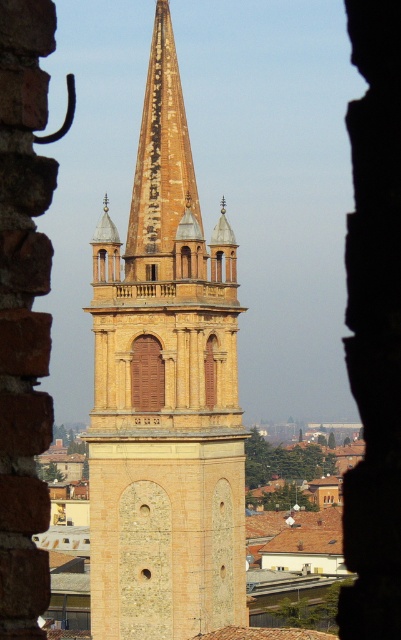
Where is `yellow stone tower at center`? This screenshot has width=401, height=640. yellow stone tower at center is located at coordinates (166, 396).

You are a GUI agent. You are given a task and a screenshot of the screen. Output one action in this format:
    pyautogui.click(x=<x>, y=<y>)
    Task: Click on the yellow stone tower at center
    The image size is (401, 640).
    Given the screenshot: What is the action you would take?
    pyautogui.click(x=166, y=396)

Is brown wooden door at center taller than matte wood window at center?

Indeed, brown wooden door at center has a greater height compared to matte wood window at center.

Which of these two, brown wooden door at center or matte wood window at center, stands taller?

brown wooden door at center

The width and height of the screenshot is (401, 640). What do you see at coordinates (147, 374) in the screenshot?
I see `brown wooden door at center` at bounding box center [147, 374].

Find the location of a particular element. brown wooden door at center is located at coordinates (147, 374).

Does yellow stone tower at center have a greater height compared to brown wooden door at center?

Yes, yellow stone tower at center is taller than brown wooden door at center.

Who is positioned more to the left, yellow stone tower at center or brown wooden door at center?

brown wooden door at center is more to the left.

Is point (218, 301) in front of point (153, 372)?

That is False.

Where is `yellow stone tower at center`? This screenshot has height=640, width=401. yellow stone tower at center is located at coordinates (166, 396).